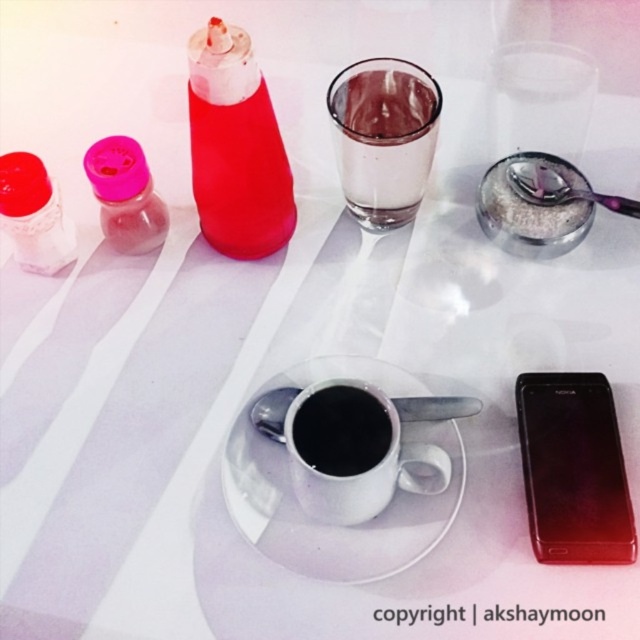
Question: Is white glossy saucer at center to the right of transparent glass at upper center from the viewer's perspective?

Choices:
 (A) no
 (B) yes

Answer: (A)

Question: Which point is closer to the camera?

Choices:
 (A) black matte cup at center
 (B) transparent glass at upper center

Answer: (A)

Question: Considering the relative positions of white glossy saucer at center and black glossy smartphone at center right in the image provided, where is white glossy saucer at center located with respect to black glossy smartphone at center right?

Choices:
 (A) below
 (B) above

Answer: (A)

Question: Is white glossy saucer at center bigger than white ceramic mug at center?

Choices:
 (A) yes
 (B) no

Answer: (A)

Question: Which object is positioned farthest from the black matte cup at center?

Choices:
 (A) transparent glass at upper center
 (B) black glossy smartphone at center right
 (C) white ceramic mug at center

Answer: (A)

Question: Which point appears farthest from the camera in this image?

Choices:
 (A) (440, 100)
 (B) (536, 410)

Answer: (A)